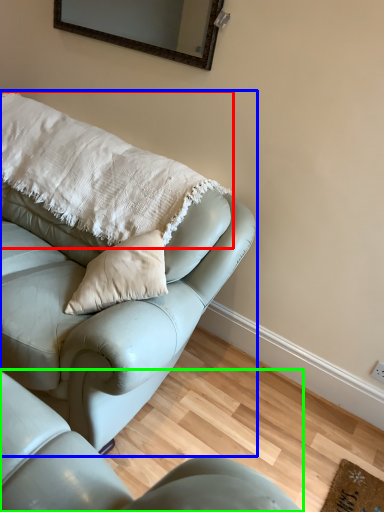
Question: Which object is the closest to the pillow (highlighted by a red box)? Choose among these: studio couch (highlighted by a blue box) or studio couch (highlighted by a green box).

Choices:
 (A) studio couch
 (B) studio couch

Answer: (A)